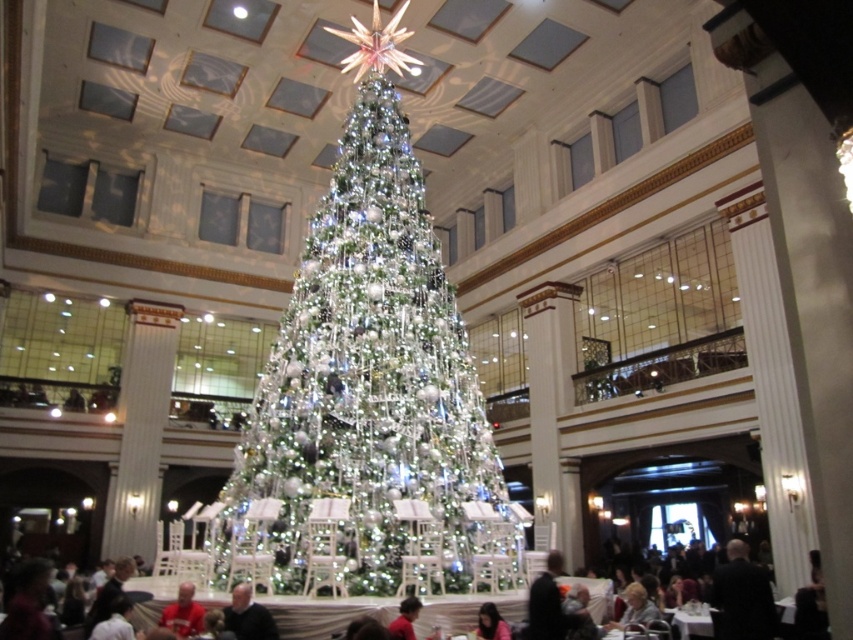
Question: Which point is farther to the camera?

Choices:
 (A) black fabric at lower right
 (B) smooth pink shirt at lower center
 (C) smooth black shirt at lower center
 (D) iridescent glass christmas tree at center

Answer: (D)

Question: Estimate the real-world distances between objects in this image. Which object is farther from the red velvet sweater at lower center?

Choices:
 (A) smooth pink shirt at lower center
 (B) black fabric at lower right
 (C) smooth black shirt at lower center
 (D) dark gray suit at lower right

Answer: (B)

Question: Observing the image, what is the correct spatial positioning of smooth pink shirt at lower center in reference to red fabric shirt at lower center?

Choices:
 (A) above
 (B) below

Answer: (B)

Question: Estimate the real-world distances between objects in this image. Which object is farther from the iridescent glass christmas tree at center?

Choices:
 (A) red velvet sweater at lower center
 (B) smooth black shirt at lower center

Answer: (A)

Question: Is smooth pink shirt at lower center thinner than red fabric shirt at lower center?

Choices:
 (A) yes
 (B) no

Answer: (B)

Question: Can you confirm if smooth black shirt at lower center is positioned to the right of red velvet sweater at lower center?

Choices:
 (A) yes
 (B) no

Answer: (A)